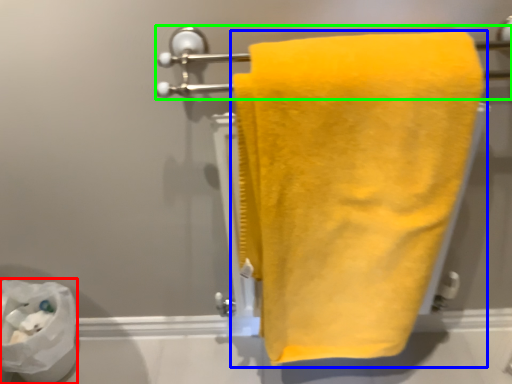
Question: Based on their relative distances, which object is nearer to toilet paper (highlighted by a red box)? Choose from towel (highlighted by a blue box) and towel bar (highlighted by a green box).

Choices:
 (A) towel
 (B) towel bar

Answer: (B)